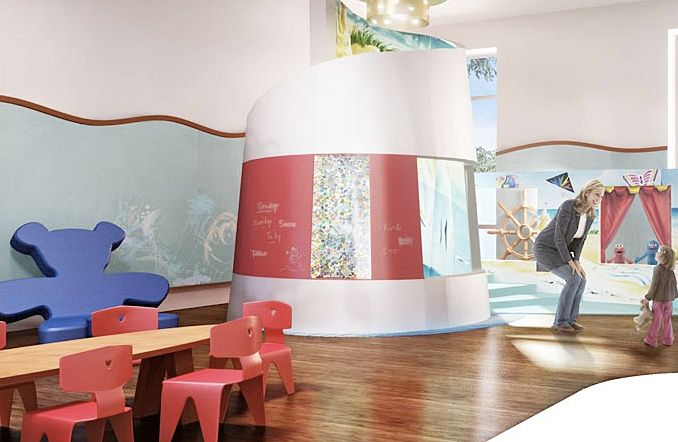
Identify the location of small red plastic chairs. point(106,397), point(196,391), point(278,358), point(133,313).